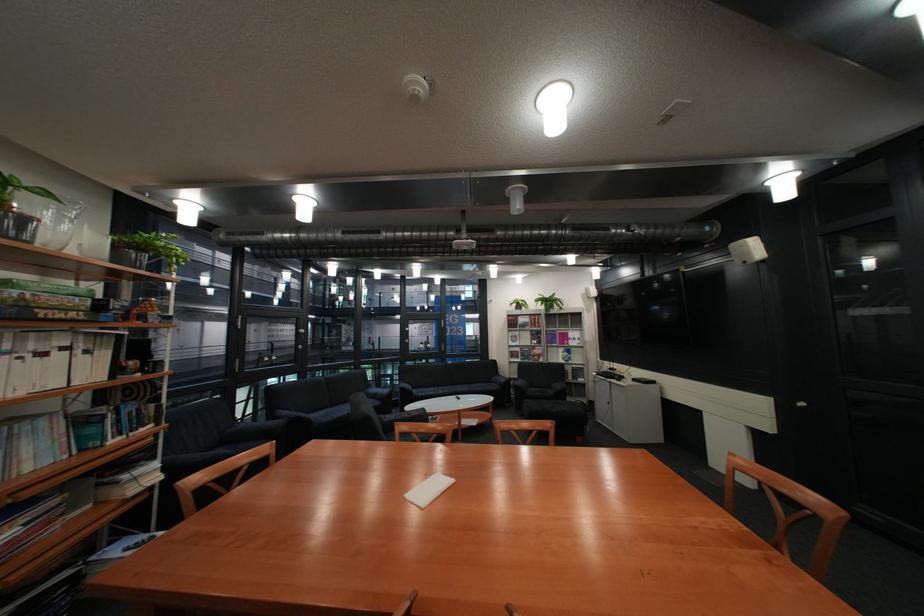
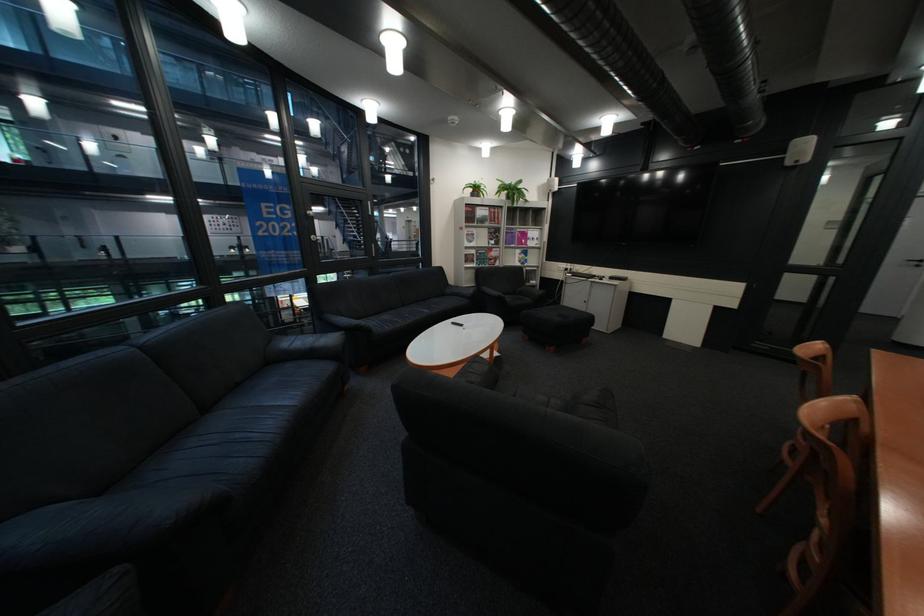
In the second image, find the point that corresponds to the point at 536,331 in the first image.

(492, 229)